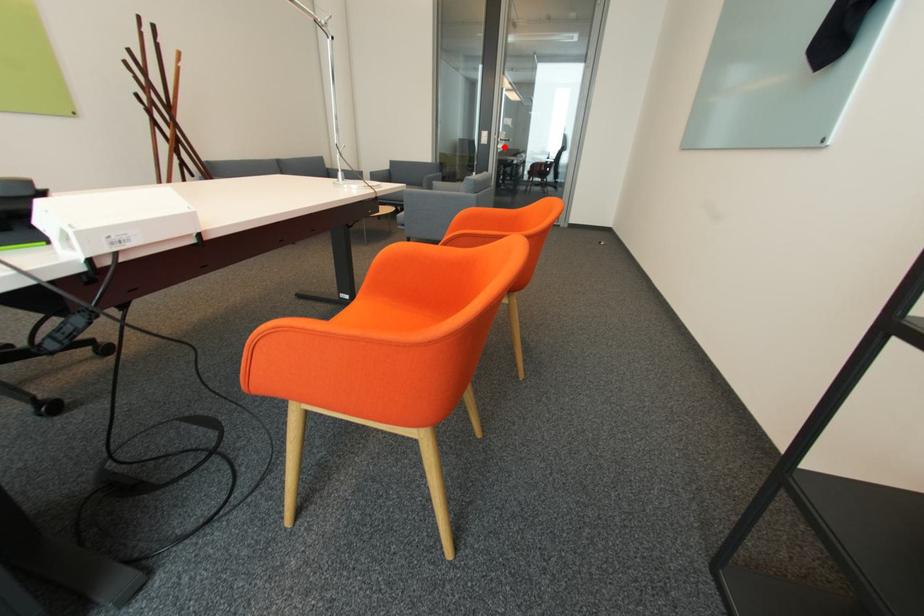
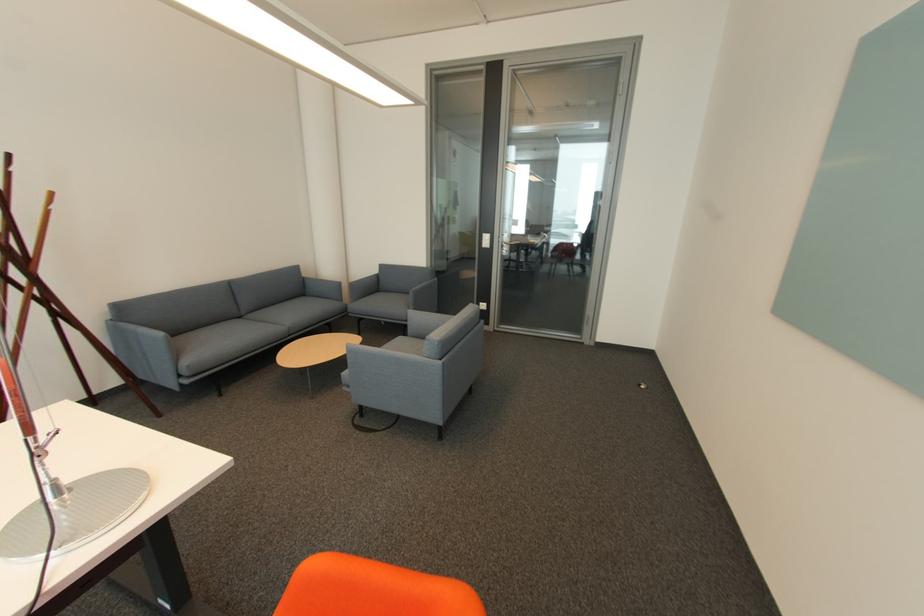
Question: I am providing you with two images of the same scene from different viewpoints. In image1, a red point is highlighted. Considering the same 3D point in image2, which of the following is correct?

Choices:
 (A) It is closer
 (B) It is farther

Answer: (B)